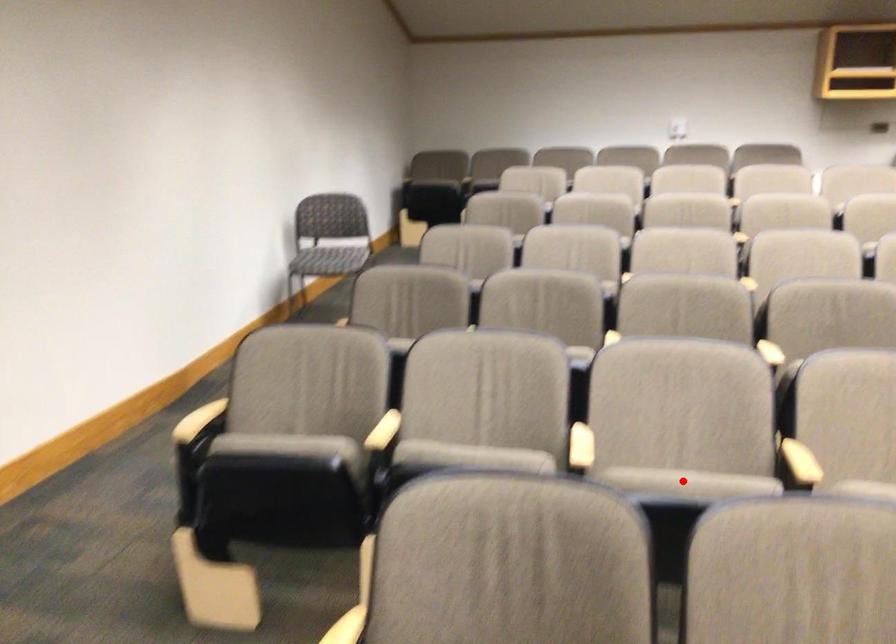
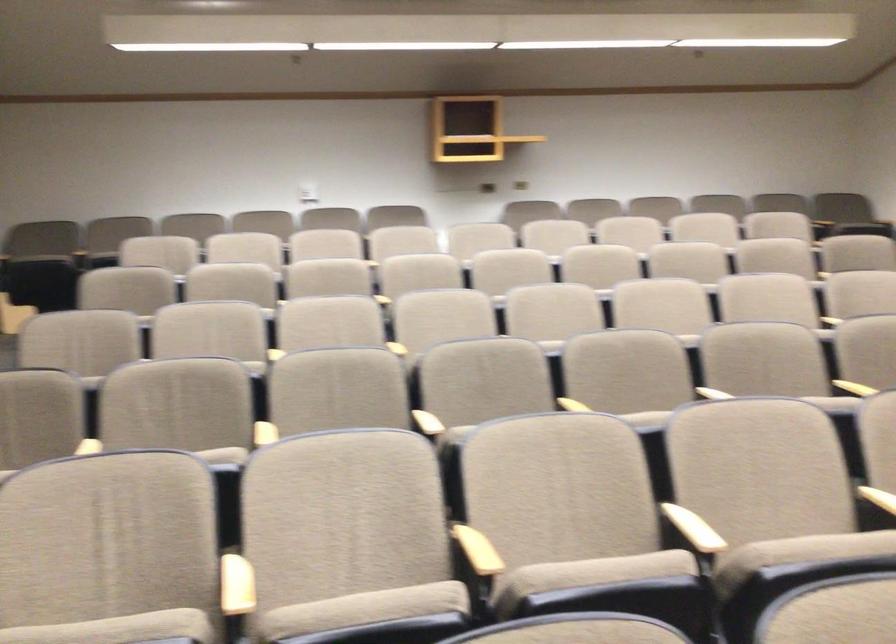
In the second image, find the point that corresponds to the highlighted location in the first image.

(362, 609)